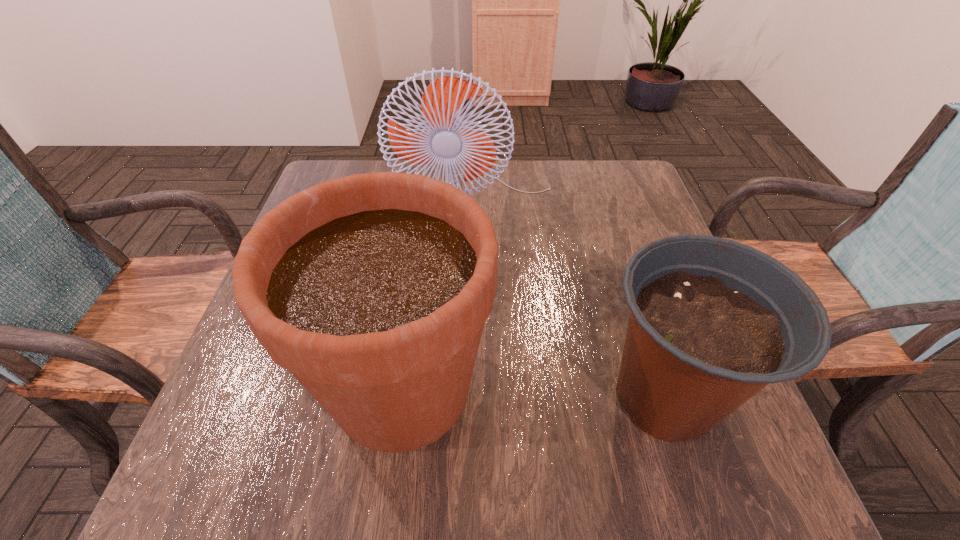
Locate an element on the screen. vacant point located between the taller flowerpot and the shortest object is located at coordinates (534, 392).

In order to click on vacant space that's between the shorter flowerpot and the taller flowerpot in this screenshot , I will do `click(534, 392)`.

Point out which object is positioned as the nearest to the fan. Please provide its 2D coordinates. Your answer should be formatted as a tuple, i.e. [(x, y)], where the tuple contains the x and y coordinates of a point satisfying the conditions above.

[(372, 289)]

Identify which object is the second closest to the tallest object. Please provide its 2D coordinates. Your answer should be formatted as a tuple, i.e. [(x, y)], where the tuple contains the x and y coordinates of a point satisfying the conditions above.

[(712, 321)]

Identify the location of vacant space that satisfies the following two spatial constraints: 1. on the front side of the second tallest object; 2. on the right side of the right flowerpot. This screenshot has width=960, height=540. (401, 397).

Where is `vacant area that satisfies the following two spatial constraints: 1. on the front-facing side of the farthest object; 2. on the left side of the right flowerpot`? Image resolution: width=960 pixels, height=540 pixels. vacant area that satisfies the following two spatial constraints: 1. on the front-facing side of the farthest object; 2. on the left side of the right flowerpot is located at coordinates (481, 397).

Identify the location of free space that satisfies the following two spatial constraints: 1. on the front-facing side of the fan; 2. on the right side of the shortest object. The height and width of the screenshot is (540, 960). (481, 397).

I want to click on free space that satisfies the following two spatial constraints: 1. on the front-facing side of the shorter flowerpot; 2. on the left side of the tallest object, so click(x=481, y=397).

The image size is (960, 540). In order to click on free location that satisfies the following two spatial constraints: 1. on the front-facing side of the shorter flowerpot; 2. on the right side of the tallest object in this screenshot , I will do (x=481, y=397).

I want to click on free space that satisfies the following two spatial constraints: 1. on the front-facing side of the shortest object; 2. on the right side of the fan, so tap(481, 397).